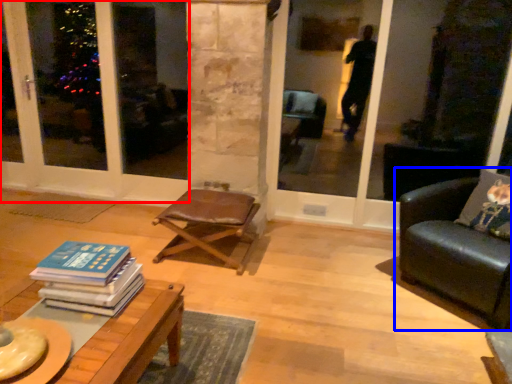
Question: Which object appears closest to the camera in this image, screen door (highlighted by a red box) or studio couch (highlighted by a blue box)?

Choices:
 (A) screen door
 (B) studio couch

Answer: (B)